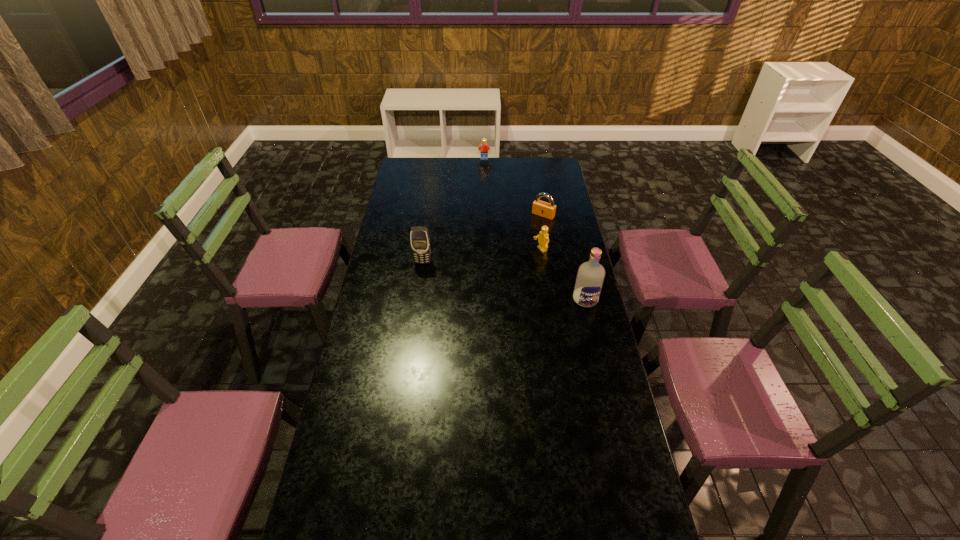
Identify the location of vacant space on the desktop that is between the cellular telephone and the vodka and is positioned on the front-facing side of the farther Lego. The image size is (960, 540). (480, 275).

Where is `vacant space on the desktop that is between the cellular telephone and the vodka and is positioned to unlock the padlock from the front`? The image size is (960, 540). vacant space on the desktop that is between the cellular telephone and the vodka and is positioned to unlock the padlock from the front is located at coordinates (492, 278).

Where is `vacant spot on the desktop that is between the fourth shortest object and the vodka and is positioned on the face of the nearer Lego`? The height and width of the screenshot is (540, 960). vacant spot on the desktop that is between the fourth shortest object and the vodka and is positioned on the face of the nearer Lego is located at coordinates (477, 275).